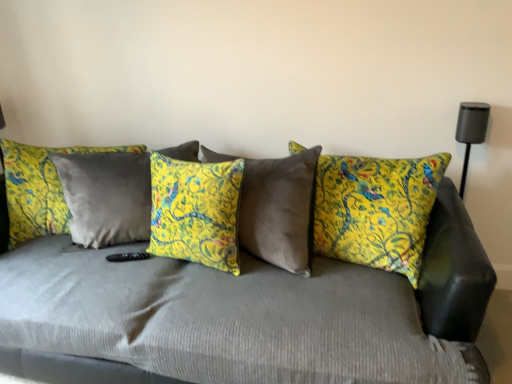
Where is `yellow floral cushion at center, positioned as the 3th pillow in left-to-right order`? Image resolution: width=512 pixels, height=384 pixels. yellow floral cushion at center, positioned as the 3th pillow in left-to-right order is located at coordinates (376, 210).

The width and height of the screenshot is (512, 384). Describe the element at coordinates (39, 188) in the screenshot. I see `yellow floral pillow at center, which is counted as the first pillow, starting from the left` at that location.

Identify the location of yellow floral cushion at center, placed as the first pillow when sorted from right to left. This screenshot has height=384, width=512. (376, 210).

Does velvet gray couch at center come in front of yellow fabric pillow at center, the second pillow viewed from the left?

Yes, the depth of velvet gray couch at center is less than that of yellow fabric pillow at center, the second pillow viewed from the left.

Considering the sizes of objects velvet gray couch at center and yellow fabric pillow at center, the second pillow when ordered from right to left, in the image provided, who is wider, velvet gray couch at center or yellow fabric pillow at center, the second pillow when ordered from right to left,?

Wider between the two is velvet gray couch at center.

Is velvet gray couch at center placed right next to yellow fabric pillow at center, the second pillow viewed from the left?

velvet gray couch at center is not next to yellow fabric pillow at center, the second pillow viewed from the left, and they're not touching.

What's the angular difference between velvet gray couch at center and yellow fabric pillow at center, the second pillow when ordered from right to left,'s facing directions?

13 degrees.

Does yellow floral pillow at center, placed as the third pillow when sorted from right to left, touch yellow fabric pillow at center, the second pillow viewed from the left?

No, yellow floral pillow at center, placed as the third pillow when sorted from right to left, is not making contact with yellow fabric pillow at center, the second pillow viewed from the left.

Which object is wider, yellow floral pillow at center, which is counted as the first pillow, starting from the left, or yellow fabric pillow at center, the second pillow viewed from the left?

yellow floral pillow at center, which is counted as the first pillow, starting from the left.

From a real-world perspective, which pillow is the 2nd one above the yellow floral pillow at center, placed as the third pillow when sorted from right to left? Please provide its 2D coordinates.

[(195, 211)]

Is yellow floral pillow at center, which is counted as the first pillow, starting from the left, situated inside yellow fabric pillow at center, the second pillow viewed from the left, or outside?

The correct answer is: outside.

Is yellow fabric pillow at center, the second pillow viewed from the left, at the left side of yellow floral pillow at center, which is counted as the first pillow, starting from the left?

No, yellow fabric pillow at center, the second pillow viewed from the left, is not to the left of yellow floral pillow at center, which is counted as the first pillow, starting from the left.

Is yellow fabric pillow at center, the second pillow viewed from the left, aimed at yellow floral pillow at center, which is counted as the first pillow, starting from the left?

No.

Does yellow fabric pillow at center, the second pillow viewed from the left, have a lesser width compared to yellow floral pillow at center, which is counted as the first pillow, starting from the left?

Indeed, yellow fabric pillow at center, the second pillow viewed from the left, has a lesser width compared to yellow floral pillow at center, which is counted as the first pillow, starting from the left.

Does yellow fabric pillow at center, the second pillow viewed from the left, have a smaller size compared to yellow floral pillow at center, which is counted as the first pillow, starting from the left?

Yes, yellow fabric pillow at center, the second pillow viewed from the left, is smaller than yellow floral pillow at center, which is counted as the first pillow, starting from the left.

Is yellow floral pillow at center, which is counted as the first pillow, starting from the left, outside of yellow floral cushion at center, placed as the first pillow when sorted from right to left?

That's correct, yellow floral pillow at center, which is counted as the first pillow, starting from the left, is outside of yellow floral cushion at center, placed as the first pillow when sorted from right to left.

Considering the points (42, 206) and (392, 255), which point is in front, point (42, 206) or point (392, 255)?

Point (392, 255)

From the image's perspective, which one is positioned lower, yellow fabric pillow at center, the second pillow viewed from the left, or yellow floral cushion at center, placed as the first pillow when sorted from right to left?

yellow fabric pillow at center, the second pillow viewed from the left.

Between yellow fabric pillow at center, the second pillow when ordered from right to left, and yellow floral cushion at center, positioned as the 3th pillow in left-to-right order, which one has smaller size?

yellow fabric pillow at center, the second pillow when ordered from right to left, is smaller.

In the scene shown: Does yellow fabric pillow at center, the second pillow when ordered from right to left, contain yellow floral cushion at center, positioned as the 3th pillow in left-to-right order?

No, yellow floral cushion at center, positioned as the 3th pillow in left-to-right order, is not inside yellow fabric pillow at center, the second pillow when ordered from right to left.

Consider the image. From a real-world perspective, is velvet gray couch at center physically located above or below yellow floral cushion at center, placed as the first pillow when sorted from right to left?

Clearly, from a real-world perspective, velvet gray couch at center is below yellow floral cushion at center, placed as the first pillow when sorted from right to left.

From their relative heights in the image, would you say velvet gray couch at center is taller or shorter than yellow floral cushion at center, placed as the first pillow when sorted from right to left?

velvet gray couch at center is taller than yellow floral cushion at center, placed as the first pillow when sorted from right to left.

Does velvet gray couch at center have a smaller size compared to yellow floral cushion at center, positioned as the 3th pillow in left-to-right order?

Actually, velvet gray couch at center might be larger than yellow floral cushion at center, positioned as the 3th pillow in left-to-right order.

Is velvet gray couch at center thinner than yellow floral cushion at center, positioned as the 3th pillow in left-to-right order?

No.

Between velvet gray couch at center and yellow floral pillow at center, which is counted as the first pillow, starting from the left, which one has larger width?

With larger width is velvet gray couch at center.

Consider the image. Is yellow floral pillow at center, placed as the third pillow when sorted from right to left, inside velvet gray couch at center?

Yes, yellow floral pillow at center, placed as the third pillow when sorted from right to left, can be found within velvet gray couch at center.

Is velvet gray couch at center shorter than yellow floral pillow at center, placed as the third pillow when sorted from right to left?

No.

Based on the photo, which is behind, velvet gray couch at center or yellow floral pillow at center, placed as the third pillow when sorted from right to left?

yellow floral pillow at center, placed as the third pillow when sorted from right to left.

You are a GUI agent. You are given a task and a screenshot of the screen. Output one action in this format:
    pyautogui.click(x=<x>, y=<y>)
    Task: Click on the studio couch in front of the yellow fabric pillow at center, the second pillow when ordered from right to left
    
    Given the screenshot: What is the action you would take?
    pyautogui.click(x=398, y=288)

Locate an element on the screen. This screenshot has width=512, height=384. the 2nd pillow located beneath the yellow fabric pillow at center, the second pillow viewed from the left (from a real-world perspective) is located at coordinates (39, 188).

Looking at the image, which one is located closer to yellow floral pillow at center, placed as the third pillow when sorted from right to left, yellow fabric pillow at center, the second pillow when ordered from right to left, or velvet gray couch at center?

yellow fabric pillow at center, the second pillow when ordered from right to left, is closer to yellow floral pillow at center, placed as the third pillow when sorted from right to left.

Which object lies nearer to the anchor point yellow floral pillow at center, placed as the third pillow when sorted from right to left, yellow fabric pillow at center, the second pillow when ordered from right to left, or yellow floral cushion at center, positioned as the 3th pillow in left-to-right order?

yellow fabric pillow at center, the second pillow when ordered from right to left, is closer to yellow floral pillow at center, placed as the third pillow when sorted from right to left.

When comparing their distances from yellow floral pillow at center, which is counted as the first pillow, starting from the left, does velvet gray couch at center or yellow fabric pillow at center, the second pillow viewed from the left, seem closer?

The object closer to yellow floral pillow at center, which is counted as the first pillow, starting from the left, is yellow fabric pillow at center, the second pillow viewed from the left.

From the image, which object appears to be farther from yellow floral cushion at center, placed as the first pillow when sorted from right to left, velvet gray couch at center or yellow floral pillow at center, placed as the third pillow when sorted from right to left?

Based on the image, yellow floral pillow at center, placed as the third pillow when sorted from right to left, appears to be further to yellow floral cushion at center, placed as the first pillow when sorted from right to left.

From the image, which object appears to be farther from yellow floral cushion at center, placed as the first pillow when sorted from right to left, yellow fabric pillow at center, the second pillow viewed from the left, or velvet gray couch at center?

yellow fabric pillow at center, the second pillow viewed from the left, is further to yellow floral cushion at center, placed as the first pillow when sorted from right to left.

When comparing their distances from yellow floral cushion at center, placed as the first pillow when sorted from right to left, does yellow floral pillow at center, placed as the third pillow when sorted from right to left, or yellow fabric pillow at center, the second pillow viewed from the left, seem closer?

The object closer to yellow floral cushion at center, placed as the first pillow when sorted from right to left, is yellow fabric pillow at center, the second pillow viewed from the left.

Based on their spatial positions, is yellow fabric pillow at center, the second pillow viewed from the left, or yellow floral pillow at center, which is counted as the first pillow, starting from the left, further from yellow floral cushion at center, placed as the first pillow when sorted from right to left?

yellow floral pillow at center, which is counted as the first pillow, starting from the left, is further to yellow floral cushion at center, placed as the first pillow when sorted from right to left.

When comparing their distances from yellow fabric pillow at center, the second pillow viewed from the left, does velvet gray couch at center or yellow floral pillow at center, placed as the third pillow when sorted from right to left, seem further?

The object further to yellow fabric pillow at center, the second pillow viewed from the left, is yellow floral pillow at center, placed as the third pillow when sorted from right to left.

Locate an element on the screen. The height and width of the screenshot is (384, 512). studio couch between yellow floral pillow at center, which is counted as the first pillow, starting from the left, and yellow floral cushion at center, positioned as the 3th pillow in left-to-right order, from left to right is located at coordinates click(x=398, y=288).

Locate an element on the screen. Image resolution: width=512 pixels, height=384 pixels. pillow between yellow floral pillow at center, which is counted as the first pillow, starting from the left, and yellow floral cushion at center, placed as the first pillow when sorted from right to left, from left to right is located at coordinates [x=195, y=211].

The image size is (512, 384). Identify the location of pillow between velvet gray couch at center and yellow floral cushion at center, positioned as the 3th pillow in left-to-right order. (195, 211).